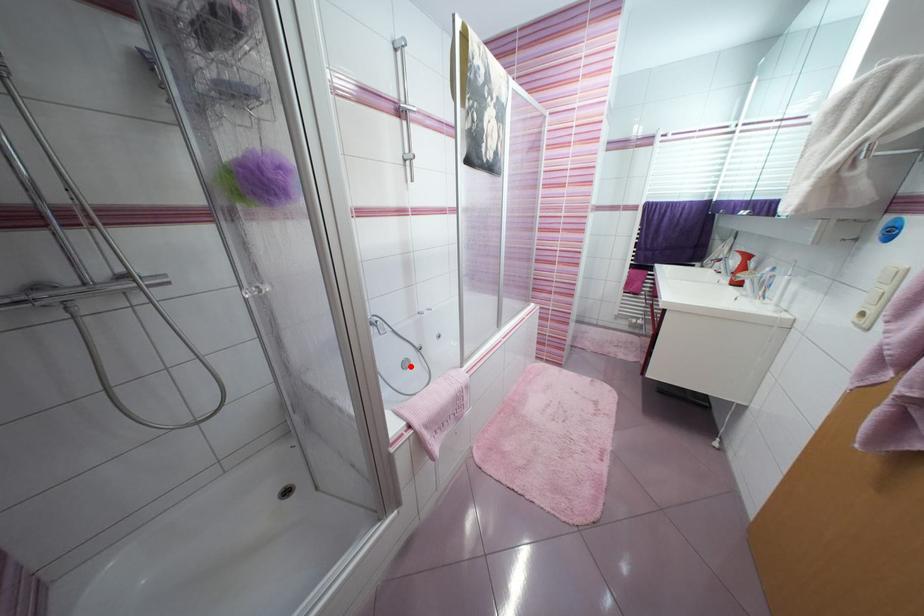
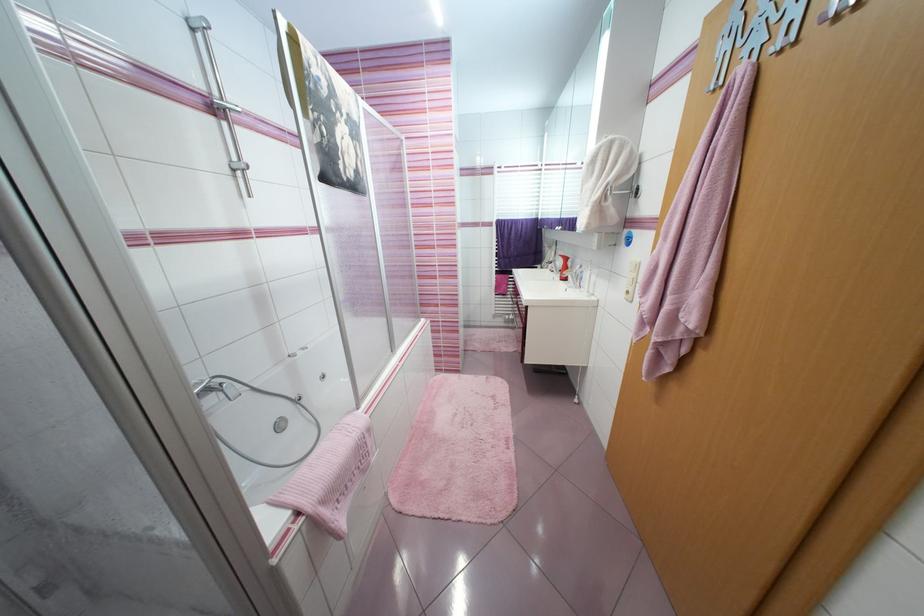
Locate, in the second image, the point that corresponds to the highlighted location in the first image.

(286, 428)